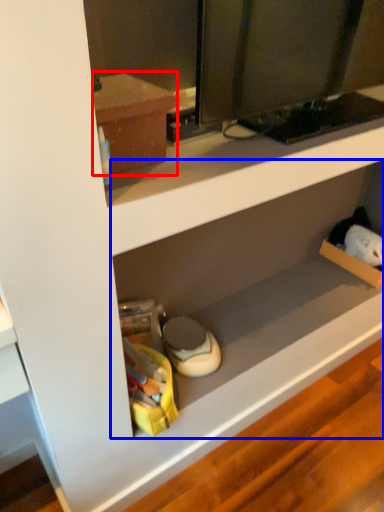
Question: Which object appears closest to the camera in this image, cabinetry (highlighted by a red box) or shelf (highlighted by a blue box)?

Choices:
 (A) cabinetry
 (B) shelf

Answer: (A)